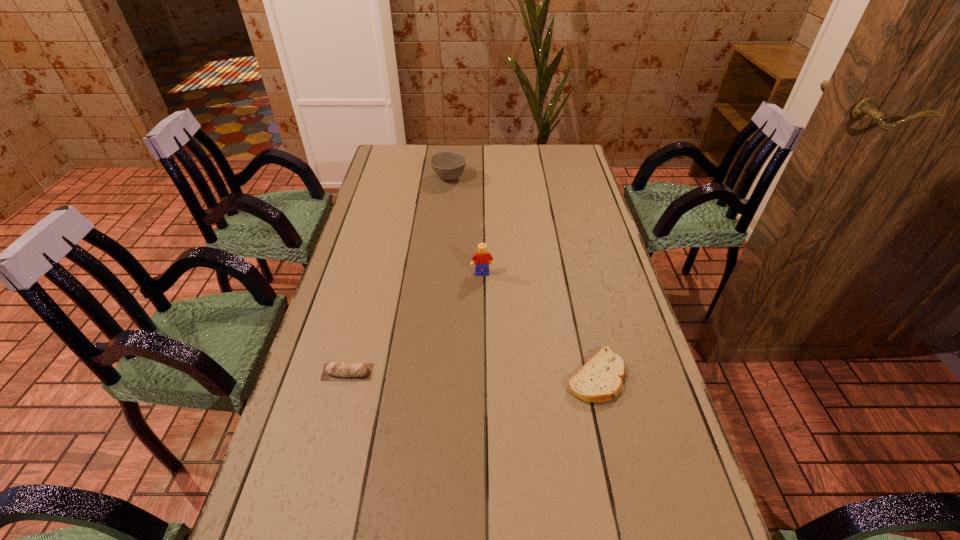
You are a GUI agent. You are given a task and a screenshot of the screen. Output one action in this format:
    pyautogui.click(x=<x>, y=<y>)
    Task: Click on the free space located on the left of the shortest object
    
    Given the screenshot: What is the action you would take?
    pyautogui.click(x=424, y=376)

The height and width of the screenshot is (540, 960). I want to click on object that is at the far edge, so click(x=449, y=165).

Identify the location of object present at the left edge. (348, 371).

Identify the location of object present at the right edge. (601, 378).

At what (x,y) coordinates should I click in order to perform the action: click on free region at the far edge of the desktop. Please return your answer as a coordinate pair (x, y). The width and height of the screenshot is (960, 540). Looking at the image, I should click on (484, 161).

In the image, there is a desktop. Where is `vacant space at the right edge`? vacant space at the right edge is located at coordinates (566, 240).

The height and width of the screenshot is (540, 960). What are the coordinates of `free space at the far left corner of the desktop` in the screenshot? It's located at (397, 164).

This screenshot has height=540, width=960. In the image, there is a desktop. Identify the location of vacant space at the far right corner. (558, 166).

The width and height of the screenshot is (960, 540). In order to click on free space that is in between the tallest object and the left pita bread in this screenshot , I will do `click(415, 323)`.

Identify the location of vacant space that is in between the second farthest object and the third object from right to left. (466, 226).